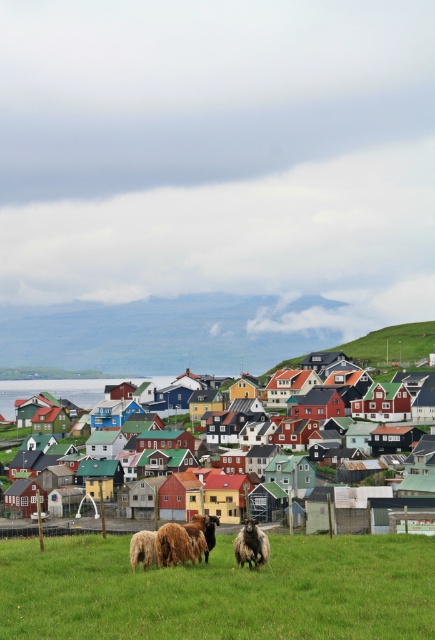
Question: Which point is closer to the camera?

Choices:
 (A) dark woolen sheep at lower center
 (B) white woolen sheep at lower center
 (C) green grassy hillside at upper right

Answer: (A)

Question: Does green grassy hillside at upper right have a greater width compared to dark woolen sheep at lower center?

Choices:
 (A) no
 (B) yes

Answer: (B)

Question: Which point is closer to the camera?

Choices:
 (A) green grass at lower center
 (B) green grassy hillside at upper right

Answer: (A)

Question: Does fluffy brown sheep at center have a larger size compared to dark woolen sheep at lower center?

Choices:
 (A) yes
 (B) no

Answer: (A)

Question: Estimate the real-world distances between objects in this image. Which object is closer to the green grass at lower center?

Choices:
 (A) dark woolen sheep at lower center
 (B) green grassy hillside at upper right
 (C) fluffy brown sheep at center

Answer: (A)

Question: Can you confirm if fluffy brown sheep at center is thinner than white woolen sheep at lower center?

Choices:
 (A) yes
 (B) no

Answer: (B)